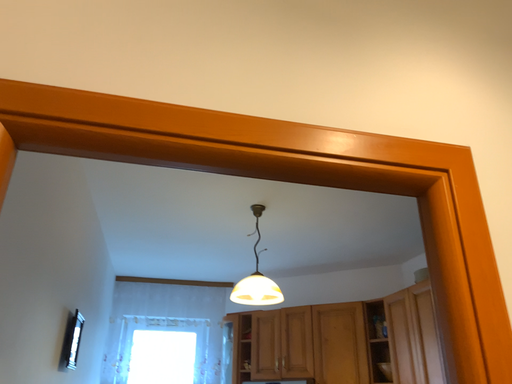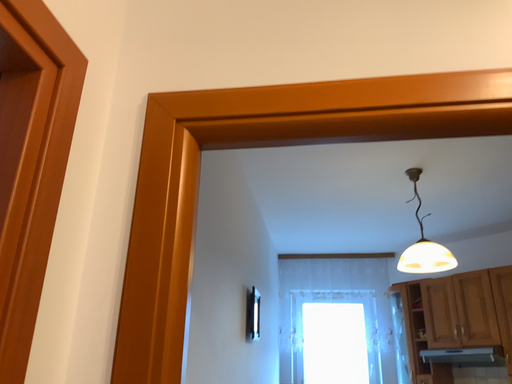
Question: How did the camera likely rotate when shooting the video?

Choices:
 (A) rotated right
 (B) rotated left

Answer: (B)